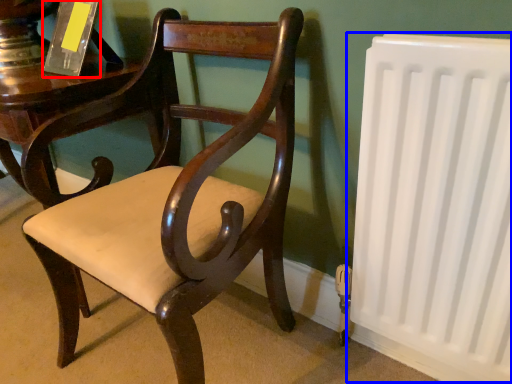
Question: Among these objects, which one is nearest to the camera, paperback book (highlighted by a red box) or radiator (highlighted by a blue box)?

Choices:
 (A) paperback book
 (B) radiator

Answer: (B)